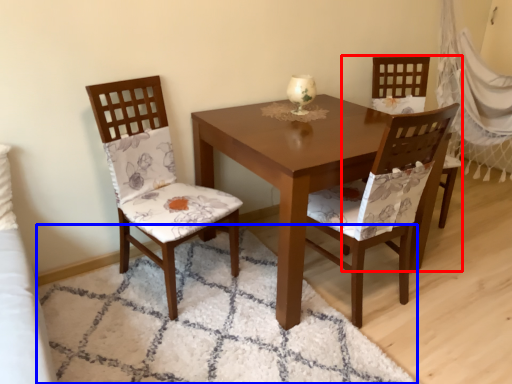
Question: Which of the following is the closest to the observer, chair (highlighted by a red box) or mat (highlighted by a blue box)?

Choices:
 (A) chair
 (B) mat

Answer: (B)